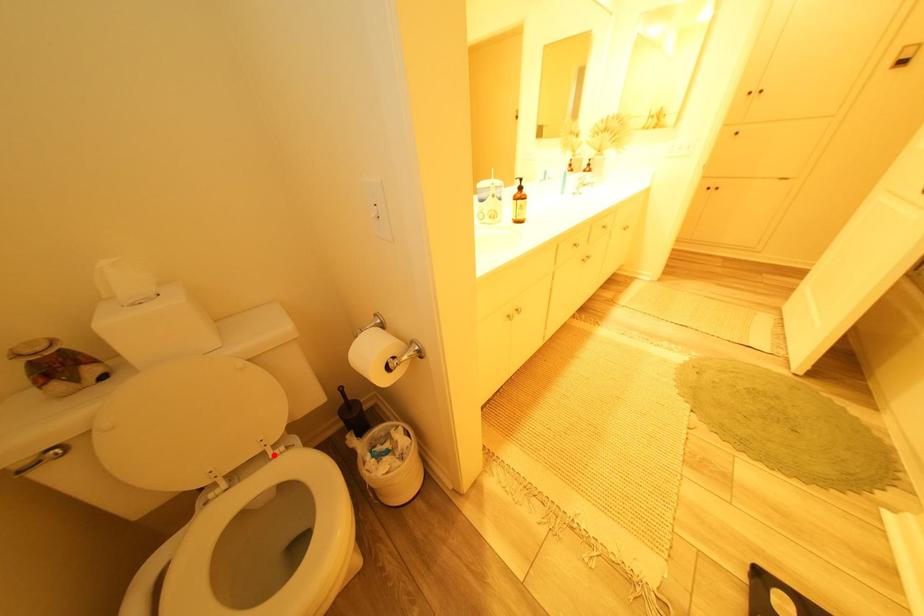
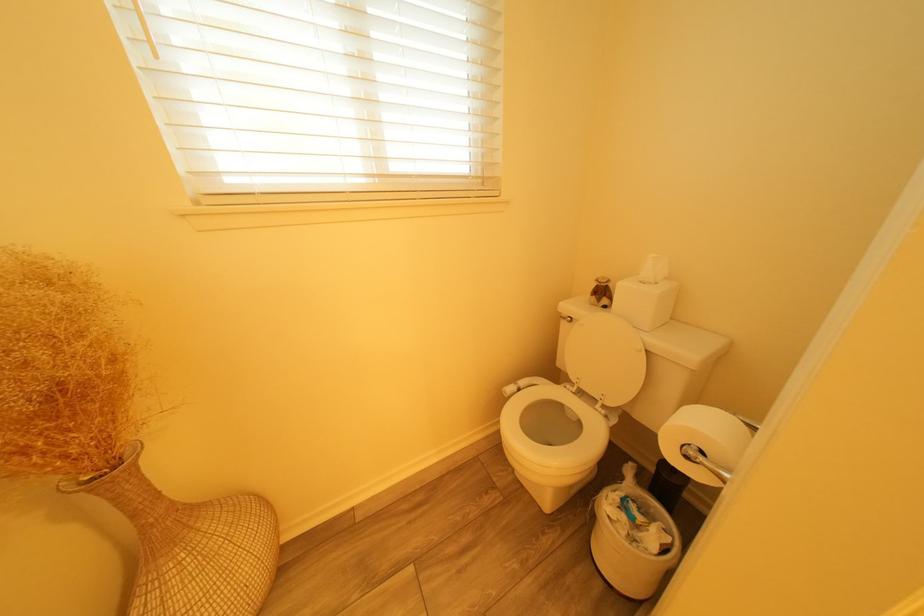
Question: A red point is marked in image1. In image2, is the corresponding 3D point closer to the camera or farther? Reply with the corresponding letter.

Choices:
 (A) The corresponding 3D point is closer.
 (B) The corresponding 3D point is farther.

Answer: (B)